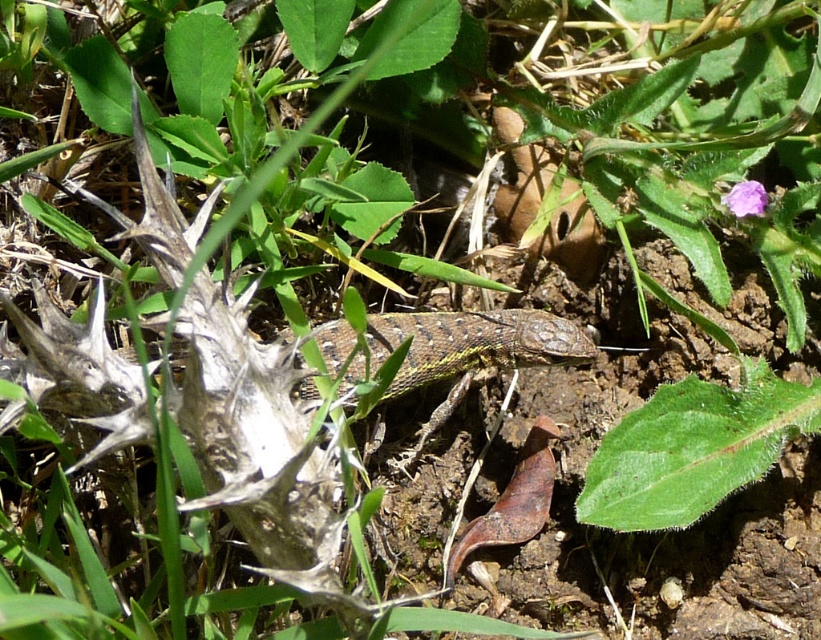
You are a gardener who wants to place a small statue between the green scaly lizard at center and the purple matte flower at upper right. Which object should you position the statue closer to if you want the statue to be closer to the smaller object?

The purple matte flower at upper right is smaller than the green scaly lizard at center. Therefore, to place the statue closer to the smaller object, position it nearer to the purple matte flower at upper right.

You are standing in the garden and want to take a photo of the two points. Which point, point [411,458] or point [737,184], will appear larger in your camera view?

Point [411,458] is further to the camera than point [737,184], so it will appear larger in the camera view.